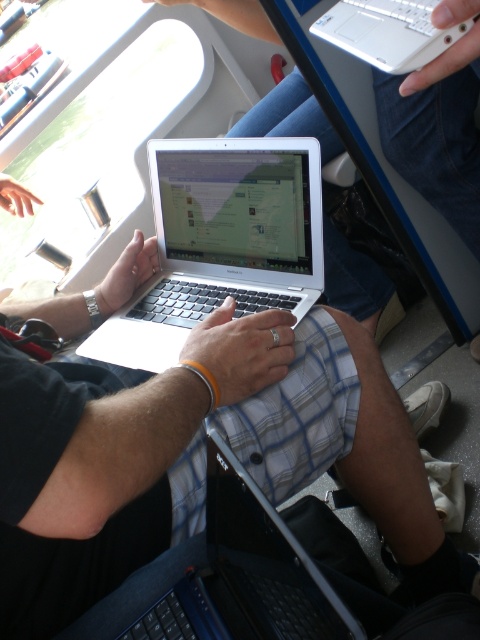
You are a passenger on a train and need to know which laptop is closer to you. You see a silver metallic laptop at center and a white plastic laptop at upper center. Which one is positioned lower?

The silver metallic laptop at center is positioned lower than the white plastic laptop at upper center because it is taller, so it occupies more vertical space and is placed below the smaller one.

You are a passenger on a train and want to place your bag between the silver metallic laptop at center and the black matte laptop at center. The bag is 45 centimeters long. Will it fit between them?

The silver metallic laptop at center and black matte laptop at center are 45.06 centimeters apart. Since the bag is 45 centimeters long, it will fit between them with a small amount of space remaining.